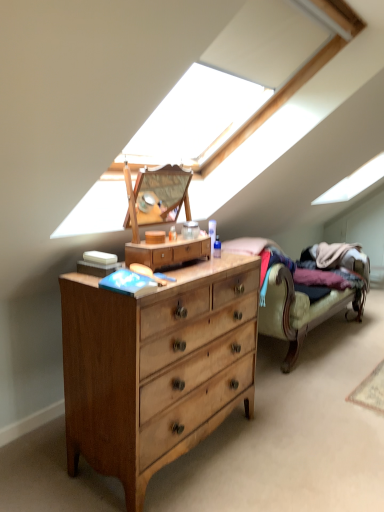
Describe the element at coordinates (300, 310) in the screenshot. This screenshot has height=512, width=384. I see `velvet beige couch at right` at that location.

I want to click on light wood chest of drawers at center, so click(156, 367).

This screenshot has height=512, width=384. What do you see at coordinates (156, 367) in the screenshot?
I see `light wood chest of drawers at center` at bounding box center [156, 367].

What is the approximate width of light brown wood dresser at center?

It is 7.92 inches.

Where is `velvet beige couch at right`? The width and height of the screenshot is (384, 512). velvet beige couch at right is located at coordinates (300, 310).

From the image's perspective, is velvet beige couch at right beneath light wood chest of drawers at center?

No.

Does velvet beige couch at right turn towards light wood chest of drawers at center?

No, velvet beige couch at right is not oriented towards light wood chest of drawers at center.

From the picture: Is velvet beige couch at right not close to light wood chest of drawers at center?

That's not correct — velvet beige couch at right is a little close to light wood chest of drawers at center.

In the scene shown: How different are the orientations of velvet beige couch at right and light wood chest of drawers at center in degrees?

The angle between the facing direction of velvet beige couch at right and the facing direction of light wood chest of drawers at center is 0.00083 degrees.

Is velvet beige couch at right facing towards light brown wood dresser at center?

No.

From the image's perspective, between velvet beige couch at right and light brown wood dresser at center, who is located below?

velvet beige couch at right, from the image's perspective.

Between point (339, 300) and point (198, 250), which one is positioned behind?

The point (339, 300) is farther.

In order to click on studio couch located below the light brown wood dresser at center (from the image's perspective) in this screenshot , I will do `click(300, 310)`.

Who is shorter, light brown wood dresser at center or light wood chest of drawers at center?

With less height is light brown wood dresser at center.

Can you tell me how much light brown wood dresser at center and light wood chest of drawers at center differ in facing direction?

They differ by 0.259 degrees in their facing directions.

Does point (197, 241) come in front of point (220, 316)?

Yes, it is.

Which is behind, light brown wood dresser at center or light wood chest of drawers at center?

light brown wood dresser at center is further away from the camera.

Looking at the image, does light wood chest of drawers at center seem bigger or smaller compared to light brown wood dresser at center?

In the image, light wood chest of drawers at center appears to be larger than light brown wood dresser at center.

Where is `file cabinet behind the light wood chest of drawers at center`? The height and width of the screenshot is (512, 384). file cabinet behind the light wood chest of drawers at center is located at coordinates (168, 252).

From the picture: From the image's perspective, is light wood chest of drawers at center located beneath light brown wood dresser at center?

Yes.

This screenshot has height=512, width=384. I want to click on studio couch beneath the light wood chest of drawers at center (from a real-world perspective), so click(300, 310).

Considering the relative sizes of light wood chest of drawers at center and velvet beige couch at right in the image provided, is light wood chest of drawers at center wider than velvet beige couch at right?

Incorrect, the width of light wood chest of drawers at center does not surpass that of velvet beige couch at right.

From the image's perspective, between light wood chest of drawers at center and velvet beige couch at right, who is located below?

light wood chest of drawers at center, from the image's perspective.

Consider the image. How much distance is there between light wood chest of drawers at center and velvet beige couch at right?

light wood chest of drawers at center and velvet beige couch at right are 33.35 inches apart.

How many degrees apart are the facing directions of light brown wood dresser at center and velvet beige couch at right?

0.259 degrees separate the facing orientations of light brown wood dresser at center and velvet beige couch at right.

Based on the photo, is light brown wood dresser at center wider or thinner than velvet beige couch at right?

light brown wood dresser at center is thinner than velvet beige couch at right.

Does light brown wood dresser at center come behind velvet beige couch at right?

No, light brown wood dresser at center is in front of velvet beige couch at right.

Considering the points (158, 253) and (314, 326), which point is behind, point (158, 253) or point (314, 326)?

The point (314, 326) is more distant.

The image size is (384, 512). In order to click on studio couch lying behind the light wood chest of drawers at center in this screenshot , I will do [300, 310].

Where is `file cabinet above the velvet beige couch at right (from a real-world perspective)`? file cabinet above the velvet beige couch at right (from a real-world perspective) is located at coordinates (168, 252).

Which object lies nearer to the anchor point light brown wood dresser at center, light wood chest of drawers at center or velvet beige couch at right?

light wood chest of drawers at center is positioned closer to the anchor light brown wood dresser at center.

When comparing their distances from light brown wood dresser at center, does velvet beige couch at right or light wood chest of drawers at center seem closer?

light wood chest of drawers at center is positioned closer to the anchor light brown wood dresser at center.

Looking at the image, which one is located further to light wood chest of drawers at center, velvet beige couch at right or light brown wood dresser at center?

Based on the image, velvet beige couch at right appears to be further to light wood chest of drawers at center.

Considering their positions, is light brown wood dresser at center positioned further to light wood chest of drawers at center than velvet beige couch at right?

velvet beige couch at right lies further to light wood chest of drawers at center than the other object.

Considering their positions, is light wood chest of drawers at center positioned closer to velvet beige couch at right than light brown wood dresser at center?

light wood chest of drawers at center.

Which object lies nearer to the anchor point velvet beige couch at right, light brown wood dresser at center or light wood chest of drawers at center?

Based on the image, light wood chest of drawers at center appears to be nearer to velvet beige couch at right.

Locate an element on the screen. This screenshot has width=384, height=512. file cabinet located between light wood chest of drawers at center and velvet beige couch at right in the left-right direction is located at coordinates (168, 252).